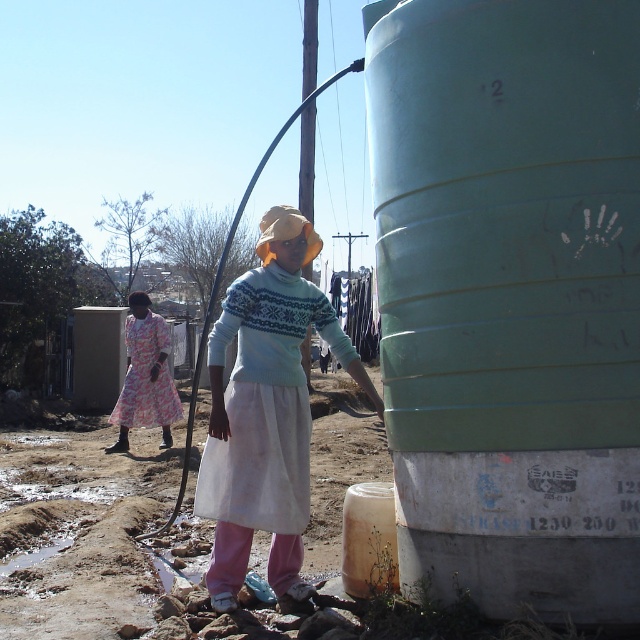
Who is more forward, [22,490] or [292,216]?

Point [292,216] is more forward.

Does brown dirt at lower left appear over light blue sweater at center?

No, brown dirt at lower left is not above light blue sweater at center.

Is point (45, 572) positioned behind point (292, 243)?

Yes, point (45, 572) is behind point (292, 243).

Find the location of a particular element. This screenshot has height=640, width=640. brown dirt at lower left is located at coordinates (81, 531).

Which is below, light blue plastic barrel at center or brown dirt at lower left?

brown dirt at lower left is lower down.

Measure the distance between light blue plastic barrel at center and camera.

light blue plastic barrel at center is 10.17 feet from camera.

Which is in front, point (476, 76) or point (88, 525)?

Point (476, 76) is in front.

Where is `light blue plastic barrel at center`? This screenshot has width=640, height=640. light blue plastic barrel at center is located at coordinates (509, 298).

Is light blue plastic barrel at center positioned behind light blue sweater at center?

No, it is not.

Is light blue plastic barrel at center closer to camera compared to light blue sweater at center?

Yes, light blue plastic barrel at center is in front of light blue sweater at center.

Which is in front, point (620, 99) or point (296, 269)?

Positioned in front is point (620, 99).

Find the location of `light blue plastic barrel at center`. light blue plastic barrel at center is located at coordinates (509, 298).